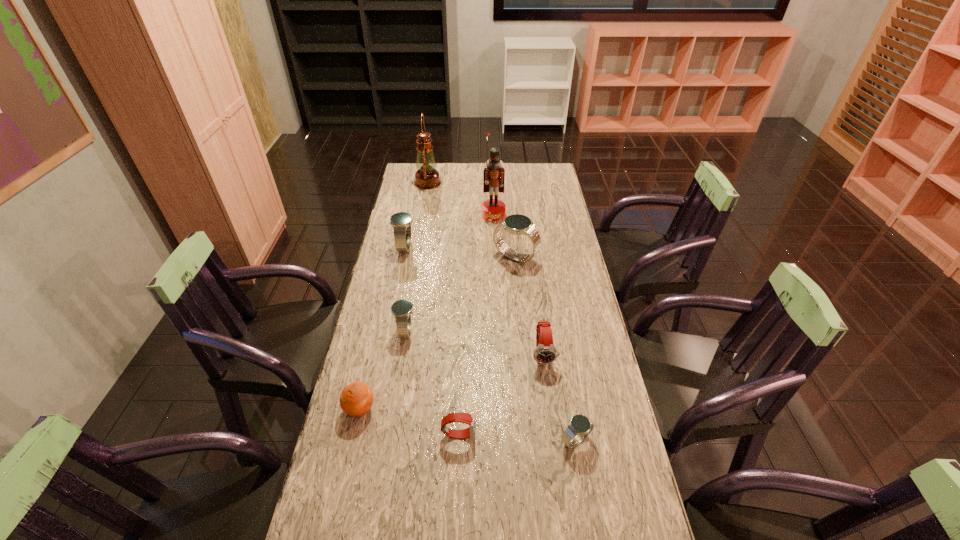
The image size is (960, 540). Identify the location of free region located 0.300m on the face of the left red watch. (588, 434).

You are a GUI agent. You are given a task and a screenshot of the screen. Output one action in this format:
    pyautogui.click(x=<x>, y=<y>)
    Task: Click on the vacant space situated on the left of the smallest blue watch
    This screenshot has width=960, height=540.
    Given the screenshot: What is the action you would take?
    pyautogui.click(x=416, y=440)

Locate an element on the screen. This screenshot has height=540, width=960. object present at the far edge is located at coordinates (427, 177).

I want to click on oil lamp located at the left edge, so click(x=427, y=177).

Find the location of a particular element. The image size is (960, 540). orange positioned at the left edge is located at coordinates (356, 399).

The width and height of the screenshot is (960, 540). I want to click on object present at the far left corner, so click(427, 177).

This screenshot has height=540, width=960. I want to click on free space at the far edge, so click(x=513, y=181).

You are a GUI agent. You are given a task and a screenshot of the screen. Output one action in this format:
    pyautogui.click(x=<x>, y=<y>)
    Task: Click on the blank space at the right edge of the desktop
    
    Given the screenshot: What is the action you would take?
    pyautogui.click(x=573, y=282)

The image size is (960, 540). Identify the location of free spot at the far right corner of the desktop. (551, 166).

I want to click on vacant point located between the smallest blue watch and the third smallest blue watch, so click(491, 343).